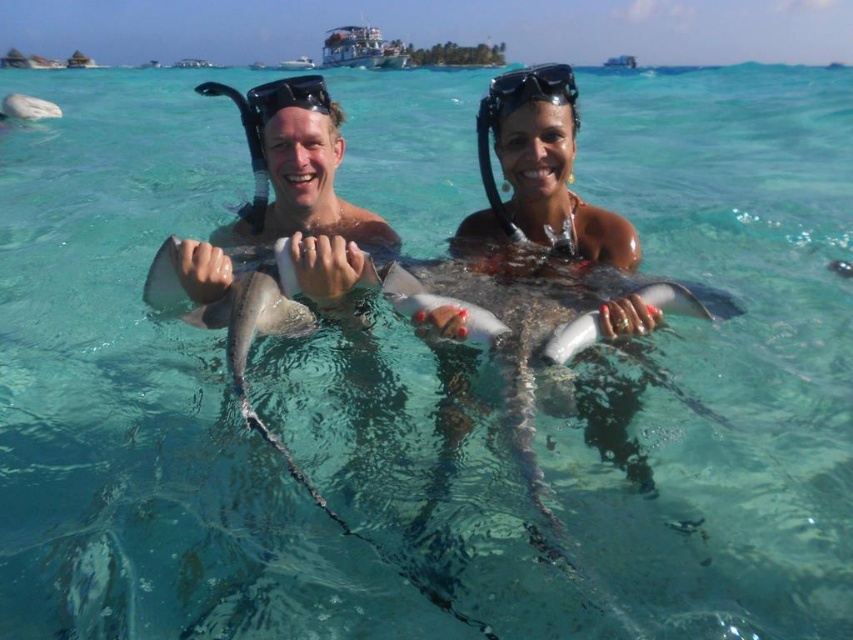
Is point (592, 397) farther from viewer compared to point (280, 109)?

No, (592, 397) is closer to viewer.

Can you confirm if matte white stingray at center is positioned to the left of matte gray shark at center?

In fact, matte white stingray at center is to the right of matte gray shark at center.

Which is behind, point (625, 243) or point (302, 288)?

Positioned behind is point (625, 243).

What are the coordinates of `matte white stingray at center` in the screenshot? It's located at (543, 248).

Between matte gray shark at center and black rubber goggles at upper center, which one has more height?

matte gray shark at center is taller.

Is matte gray shark at center closer to camera compared to black rubber goggles at upper center?

Yes.

What do you see at coordinates (288, 204) in the screenshot? I see `matte gray shark at center` at bounding box center [288, 204].

Find the location of `matte gray shark at center`. matte gray shark at center is located at coordinates (288, 204).

Who is lower down, black rubber goggles at upper center or black matte snorkel mask at upper center?

black matte snorkel mask at upper center is lower down.

Is point (567, 65) farther from camera compared to point (263, 104)?

That is True.

Identify the location of black rubber goggles at upper center. (529, 88).